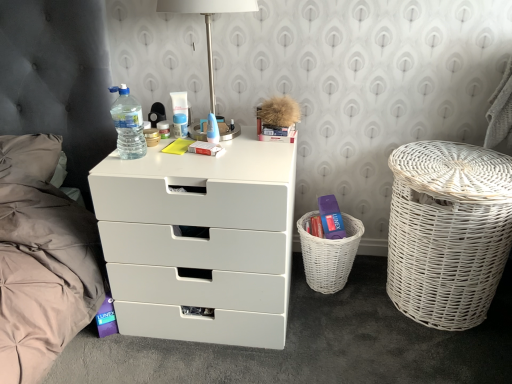
Question: Considering the positions of blue plastic container at center, the 1th toiletry when ordered from right to left, and translucent plastic cream at center, which is counted as the second toiletry, starting from the right, in the image, is blue plastic container at center, the 1th toiletry when ordered from right to left, bigger or smaller than translucent plastic cream at center, which is counted as the second toiletry, starting from the right,?

Choices:
 (A) big
 (B) small

Answer: (B)

Question: In the image, is blue plastic container at center, arranged as the third toiletry when viewed from the left, positioned in front of or behind translucent plastic cream at center, acting as the second toiletry starting from the left?

Choices:
 (A) behind
 (B) front

Answer: (B)

Question: Which object is positioned closest to the satin nickel table lamp at upper center?

Choices:
 (A) white wicker basket at lower right
 (B) blue plastic container at center, arranged as the third toiletry when viewed from the left
 (C) translucent plastic bottle at upper left
 (D) translucent plastic cream at center, acting as the second toiletry starting from the left
 (E) white wicker laundry basket at right

Answer: (B)

Question: Which of these objects is positioned farthest from the blue plastic container at center, the 1th toiletry when ordered from right to left?

Choices:
 (A) satin nickel table lamp at upper center
 (B) white wicker laundry basket at right
 (C) translucent plastic tube at center, the first toiletry in the left-to-right sequence
 (D) white matte chest of drawers at center
 (E) translucent plastic cream at center, acting as the second toiletry starting from the left

Answer: (B)